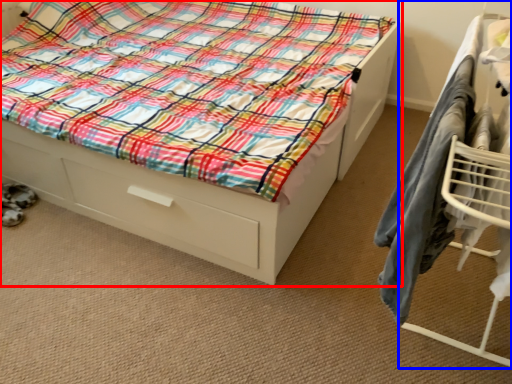
Question: Among these objects, which one is nearest to the camera, bed (highlighted by a red box) or furniture (highlighted by a blue box)?

Choices:
 (A) bed
 (B) furniture

Answer: (B)